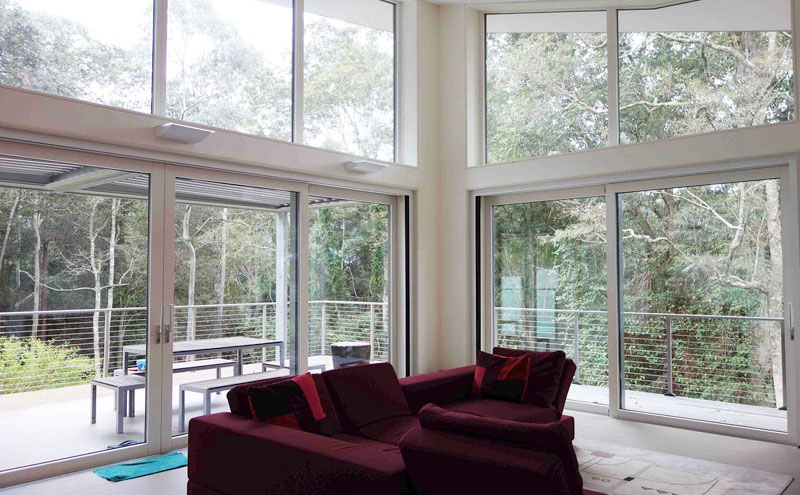
Locate an element on the screen. This screenshot has height=495, width=800. rug is located at coordinates (156, 466), (682, 466).